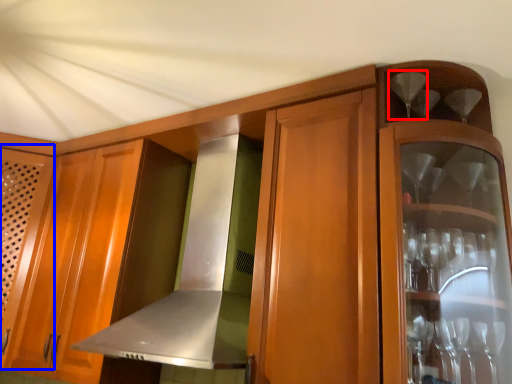
Question: Which object is further to the camera taking this photo, wine glass (highlighted by a red box) or door (highlighted by a blue box)?

Choices:
 (A) wine glass
 (B) door

Answer: (B)